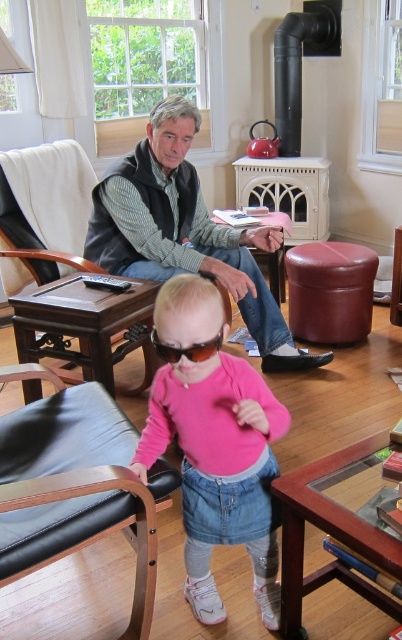
Question: Does black leather armchair at lower left have a smaller size compared to gray vest at center?

Choices:
 (A) no
 (B) yes

Answer: (B)

Question: Which is farther from the gray vest at center?

Choices:
 (A) brown matte sunglasses at center
 (B) black leather armchair at lower left

Answer: (A)

Question: Can you confirm if leather-like stool at center is bigger than brown matte sunglasses at center?

Choices:
 (A) yes
 (B) no

Answer: (A)

Question: Based on their relative distances, which object is farther from the black leather armchair at lower left?

Choices:
 (A) brown matte sunglasses at center
 (B) pink fabric sweater at center
 (C) leather-like stool at center

Answer: (C)

Question: Does black leather armchair at lower left have a lesser width compared to brown matte sunglasses at center?

Choices:
 (A) yes
 (B) no

Answer: (B)

Question: Which object is farther from the camera taking this photo?

Choices:
 (A) pink fabric sweater at center
 (B) gray vest at center

Answer: (B)